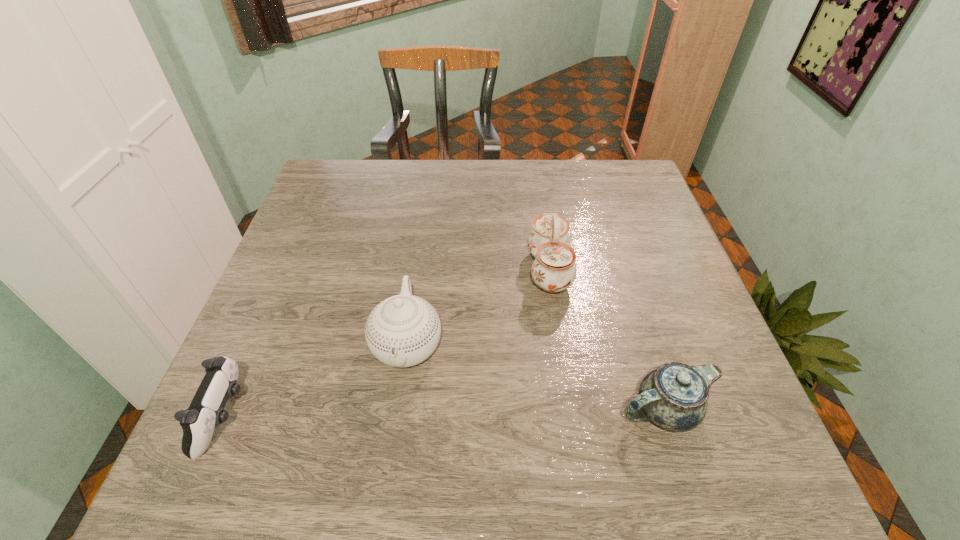
Find the location of a particular element. vacant space situated from the spout of the rightmost chinaware is located at coordinates (403, 410).

Image resolution: width=960 pixels, height=540 pixels. What are the coordinates of `blank space located from the spout of the rightmost chinaware` in the screenshot? It's located at (409, 410).

At what (x,y) coordinates should I click in order to perform the action: click on blank space located 0.230m from the spout of the rightmost chinaware. Please return your answer as a coordinate pair (x, y). Looking at the image, I should click on [487, 410].

Where is `vacant region located on the front-facing side of the control`? The width and height of the screenshot is (960, 540). vacant region located on the front-facing side of the control is located at coordinates (396, 417).

Where is `chinaware located in the near edge section of the desktop`? This screenshot has height=540, width=960. chinaware located in the near edge section of the desktop is located at coordinates (674, 397).

I want to click on control situated at the near edge, so click(206, 411).

Image resolution: width=960 pixels, height=540 pixels. Find the location of `object at the left edge`. object at the left edge is located at coordinates (206, 411).

This screenshot has width=960, height=540. Identify the location of object present at the right edge. (674, 397).

This screenshot has width=960, height=540. I want to click on object situated at the near left corner, so click(206, 411).

Find the location of a particular element. This screenshot has width=960, height=540. object that is at the near right corner is located at coordinates (674, 397).